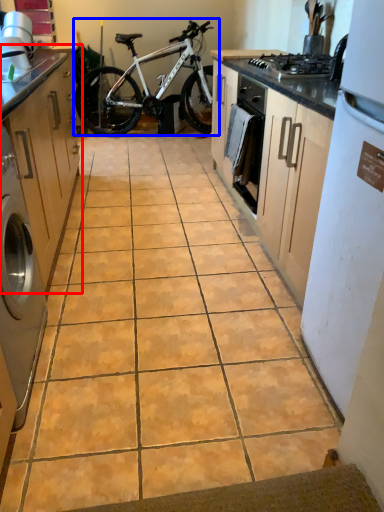
Question: Which of the following is the farthest to the observer, cabinetry (highlighted by a red box) or bicycle (highlighted by a blue box)?

Choices:
 (A) cabinetry
 (B) bicycle

Answer: (B)